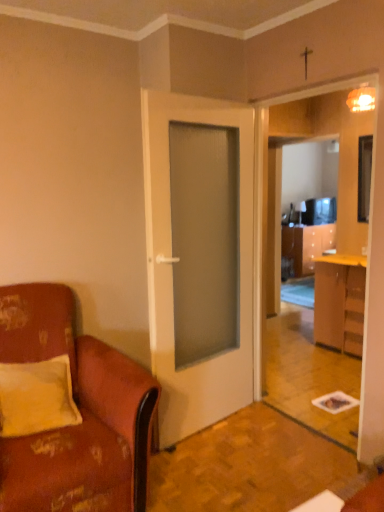
Image resolution: width=384 pixels, height=512 pixels. What are the coordinates of `vacant area that is in front of white matte door at center` in the screenshot? It's located at (226, 466).